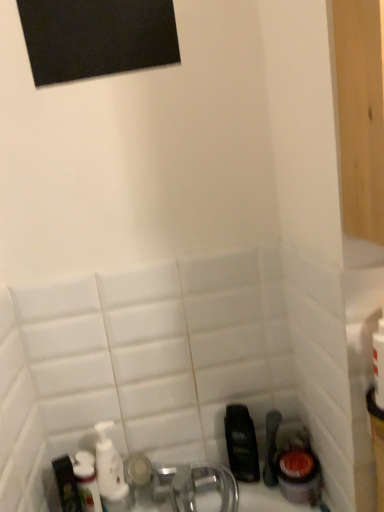
Question: From a real-world perspective, is white glossy bottle at lower left above or below white glossy mouthwash at lower left, the second mouthwash from the right?

Choices:
 (A) above
 (B) below

Answer: (A)

Question: Considering the positions of point (77, 478) and point (120, 474), is point (77, 478) closer or farther from the camera than point (120, 474)?

Choices:
 (A) closer
 (B) farther

Answer: (A)

Question: Which object is the farthest from the dark brown plastic mouthwash at lower right, which is the first mouthwash from right to left?

Choices:
 (A) white glossy mouthwash at lower left, the 1th mouthwash when ordered from left to right
 (B) white glossy bottle at lower left

Answer: (B)

Question: Which is nearer to the white glossy bottle at lower left?

Choices:
 (A) white glossy mouthwash at lower left, the 1th mouthwash when ordered from left to right
 (B) dark brown plastic mouthwash at lower right, the second mouthwash positioned from the left

Answer: (A)